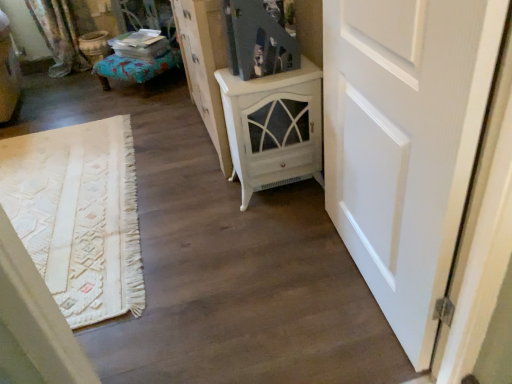
Based on the photo, what is the approximate width of white painted wood cabinet at center?

It is 18.86 inches.

Identify the location of white distressed cabinet at center. [x=204, y=66].

Considering the sizes of white painted wood cabinet at center and white distressed cabinet at center in the image, is white painted wood cabinet at center wider or thinner than white distressed cabinet at center?

Considering their sizes, white painted wood cabinet at center looks broader than white distressed cabinet at center.

From a real-world perspective, is white painted wood cabinet at center beneath white distressed cabinet at center?

Yes, from a real-world perspective, white painted wood cabinet at center is under white distressed cabinet at center.

Can you tell me how much white painted wood cabinet at center and white distressed cabinet at center differ in facing direction?

The angular difference between white painted wood cabinet at center and white distressed cabinet at center is 0.658 degrees.

Measure the distance between white painted wood cabinet at center and white distressed cabinet at center.

white painted wood cabinet at center is 13.32 inches from white distressed cabinet at center.

Considering the relative sizes of textured teal ottoman at left and white distressed cabinet at center in the image provided, is textured teal ottoman at left smaller than white distressed cabinet at center?

Indeed, textured teal ottoman at left has a smaller size compared to white distressed cabinet at center.

Can you tell me how much textured teal ottoman at left and white distressed cabinet at center differ in facing direction?

The angular difference between textured teal ottoman at left and white distressed cabinet at center is 41.2 degrees.

Is textured teal ottoman at left not close to white distressed cabinet at center?

textured teal ottoman at left is near white distressed cabinet at center, not far away.

From a real-world perspective, is textured teal ottoman at left above or below white distressed cabinet at center?

Clearly, from a real-world perspective, textured teal ottoman at left is below white distressed cabinet at center.

Identify the location of door above the textured teal ottoman at left (from a real-world perspective). (405, 143).

From the picture: Could you tell me if textured teal ottoman at left is turned towards white matte door at right?

No, textured teal ottoman at left is not oriented towards white matte door at right.

Between textured teal ottoman at left and white matte door at right, which one has more height?

white matte door at right.

From the image's perspective, is textured teal ottoman at left on white matte door at right?

Yes, from the image's perspective, textured teal ottoman at left is on top of white matte door at right.

How different are the orientations of white distressed cabinet at center and white painted wood cabinet at center in degrees?

The angular difference between white distressed cabinet at center and white painted wood cabinet at center is 0.658 degrees.

From the image's perspective, which is below, white distressed cabinet at center or white painted wood cabinet at center?

white painted wood cabinet at center appears lower in the image.

Identify the location of chest of drawers below the white distressed cabinet at center (from the image's perspective). The height and width of the screenshot is (384, 512). (273, 127).

Which is behind, point (224, 43) or point (229, 91)?

The point (224, 43) is farther from the camera.

Does white matte door at right turn towards white distressed cabinet at center?

No, white matte door at right does not turn towards white distressed cabinet at center.

Is white matte door at right thinner than white distressed cabinet at center?

Correct, the width of white matte door at right is less than that of white distressed cabinet at center.

Between white matte door at right and white distressed cabinet at center, which one appears on the right side from the viewer's perspective?

Positioned to the right is white matte door at right.

From the picture: Is white matte door at right in contact with white distressed cabinet at center?

white matte door at right and white distressed cabinet at center are clearly separated.

Can we say white distressed cabinet at center lies outside textured teal ottoman at left?

white distressed cabinet at center lies outside textured teal ottoman at left's area.

From the picture: Is white distressed cabinet at center further to camera compared to textured teal ottoman at left?

No, white distressed cabinet at center is closer to the viewer.

Looking at this image, how many degrees apart are the facing directions of white distressed cabinet at center and textured teal ottoman at left?

The angular difference between white distressed cabinet at center and textured teal ottoman at left is 41.2 degrees.

You are a GUI agent. You are given a task and a screenshot of the screen. Output one action in this format:
    pyautogui.click(x=<x>, y=<y>)
    Task: Click on the cabinetry lying on the right of textured teal ottoman at left
    The width and height of the screenshot is (512, 384).
    Given the screenshot: What is the action you would take?
    pyautogui.click(x=204, y=66)

Would you say white matte door at right is inside or outside white painted wood cabinet at center?

white matte door at right is not enclosed by white painted wood cabinet at center.

Considering the relative sizes of white matte door at right and white painted wood cabinet at center in the image provided, is white matte door at right shorter than white painted wood cabinet at center?

Incorrect, the height of white matte door at right does not fall short of that of white painted wood cabinet at center.

Which is more to the right, white matte door at right or white painted wood cabinet at center?

From the viewer's perspective, white matte door at right appears more on the right side.

Find the location of a particular element. This screenshot has width=512, height=384. cabinetry that is behind the white painted wood cabinet at center is located at coordinates (204, 66).

At what (x,y) coordinates should I click in order to perform the action: click on furniture above the white distressed cabinet at center (from the image's perspective). Please return your answer as a coordinate pair (x, y). The width and height of the screenshot is (512, 384). Looking at the image, I should click on (134, 68).

In the scene shown: Estimate the real-world distances between objects in this image. Which object is closer to white matte door at right, white painted wood cabinet at center or white distressed cabinet at center?

white painted wood cabinet at center is closer to white matte door at right.

Considering their positions, is white distressed cabinet at center positioned closer to textured teal ottoman at left than white painted wood cabinet at center?

Based on the image, white distressed cabinet at center appears to be nearer to textured teal ottoman at left.

Looking at the image, which one is located closer to white matte door at right, textured teal ottoman at left or white painted wood cabinet at center?

white painted wood cabinet at center is positioned closer to the anchor white matte door at right.

Considering their positions, is white matte door at right positioned further to white painted wood cabinet at center than textured teal ottoman at left?

textured teal ottoman at left.

Looking at the image, which one is located closer to textured teal ottoman at left, white painted wood cabinet at center or white distressed cabinet at center?

white distressed cabinet at center.

Considering their positions, is textured teal ottoman at left positioned further to white distressed cabinet at center than white matte door at right?

white matte door at right.

Based on their spatial positions, is white matte door at right or white distressed cabinet at center closer to white painted wood cabinet at center?

white distressed cabinet at center is positioned closer to the anchor white painted wood cabinet at center.

Looking at the image, which one is located closer to textured teal ottoman at left, white distressed cabinet at center or white matte door at right?

white distressed cabinet at center.

The image size is (512, 384). Identify the location of the chest of drawers located between white matte door at right and white distressed cabinet at center in the depth direction. (273, 127).

Where is `cabinetry positioned between white matte door at right and textured teal ottoman at left from near to far`? The image size is (512, 384). cabinetry positioned between white matte door at right and textured teal ottoman at left from near to far is located at coordinates (204, 66).

Identify the location of cabinetry located between white painted wood cabinet at center and textured teal ottoman at left in the depth direction. This screenshot has height=384, width=512. (204, 66).

Locate an element on the screen. The image size is (512, 384). chest of drawers between white matte door at right and textured teal ottoman at left from front to back is located at coordinates (273, 127).